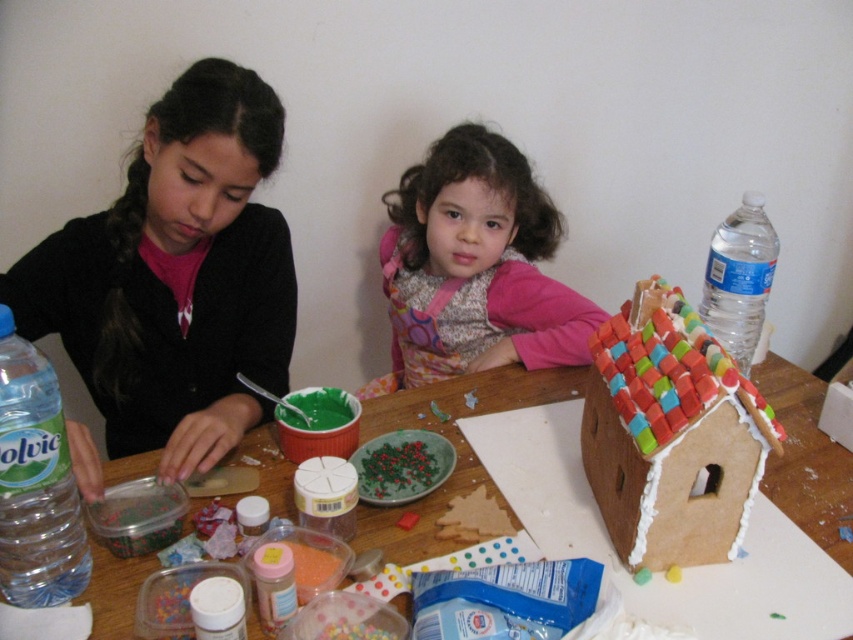
Does wooden table at center have a lesser height compared to clear plastic bottle at upper right?

Yes, wooden table at center is shorter than clear plastic bottle at upper right.

At what (x,y) coordinates should I click in order to perform the action: click on wooden table at center. Please return your answer as a coordinate pair (x, y). Looking at the image, I should click on (456, 449).

Describe the element at coordinates (456, 449) in the screenshot. I see `wooden table at center` at that location.

Locate an element on the screen. This screenshot has width=853, height=640. wooden table at center is located at coordinates pos(456,449).

Is matte black sweater at left thinner than wooden table at center?

Yes, matte black sweater at left is thinner than wooden table at center.

Between matte black sweater at left and wooden table at center, which one has more height?

With more height is matte black sweater at left.

Is point (131, 396) positioned before point (773, 490)?

No, it is not.

In order to click on matte black sweater at left in this screenshot , I will do `click(177, 276)`.

Does colorful candy house at center have a smaller size compared to clear plastic bottle at lower left?

Actually, colorful candy house at center might be larger than clear plastic bottle at lower left.

Is colorful candy house at center wider than clear plastic bottle at lower left?

Correct, the width of colorful candy house at center exceeds that of clear plastic bottle at lower left.

Who is more distant from viewer, (585, 429) or (42, 426)?

Positioned behind is point (585, 429).

This screenshot has height=640, width=853. Find the location of `colorful candy house at center`. colorful candy house at center is located at coordinates (671, 435).